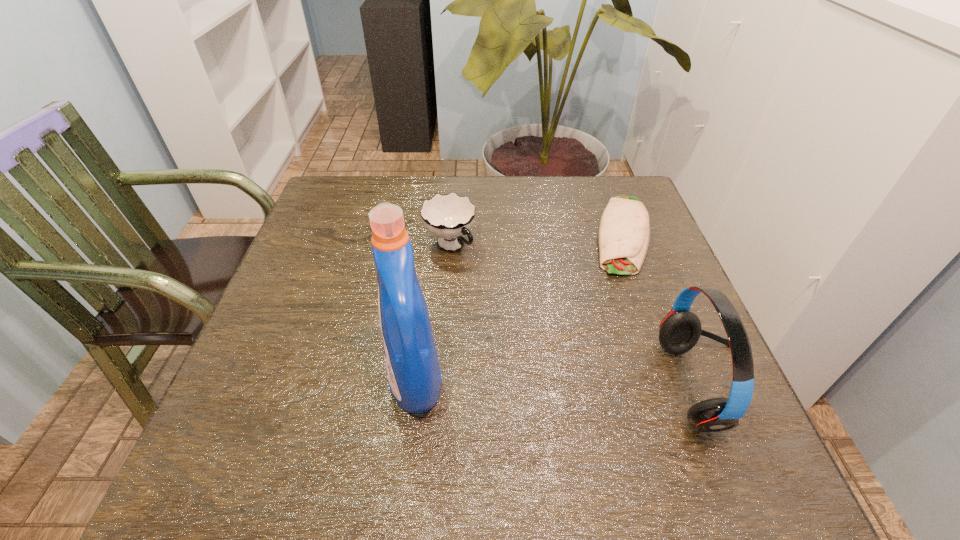
Locate an element on the screen. This screenshot has height=540, width=960. vacant point located between the headset and the detergent is located at coordinates (564, 384).

The width and height of the screenshot is (960, 540). Identify the location of unoccupied position between the tallest object and the burrito. (518, 307).

I want to click on vacant region between the cup and the second tallest object, so [581, 316].

The image size is (960, 540). In order to click on free space between the tallest object and the burrito in this screenshot , I will do 518,307.

This screenshot has height=540, width=960. What are the coordinates of `empty location between the headset and the second shortest object` in the screenshot? It's located at (581, 316).

You are a GUI agent. You are given a task and a screenshot of the screen. Output one action in this format:
    pyautogui.click(x=<x>, y=<y>)
    Task: Click on the free space between the headset and the burrito
    The height and width of the screenshot is (540, 960).
    Given the screenshot: What is the action you would take?
    pyautogui.click(x=667, y=310)

You are a GUI agent. You are given a task and a screenshot of the screen. Output one action in this format:
    pyautogui.click(x=<x>, y=<y>)
    Task: Click on the vacant area that lies between the detergent and the third shortest object
    
    Given the screenshot: What is the action you would take?
    pyautogui.click(x=564, y=384)

I want to click on object that can be found as the second closest to the shortest object, so click(x=450, y=216).

Identify the location of object that is the third closest one to the shortest object. (414, 376).

At what (x,y) coordinates should I click in order to perform the action: click on free space that satisfies the following two spatial constraints: 1. on the front side of the second tallest object; 2. with the microphone attached to the side of the shortest object. Please return your answer as a coordinate pair (x, y). Looking at the image, I should click on (680, 386).